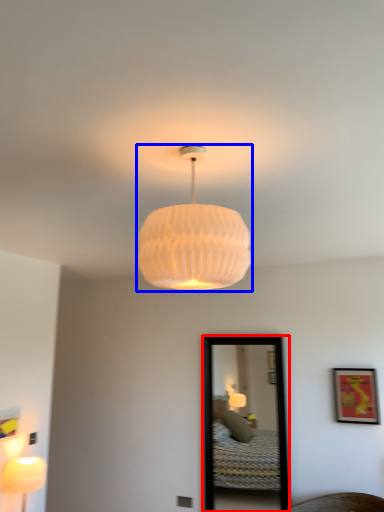
Question: Which object appears closest to the camera in this image, mirror (highlighted by a red box) or lamp (highlighted by a blue box)?

Choices:
 (A) mirror
 (B) lamp

Answer: (B)